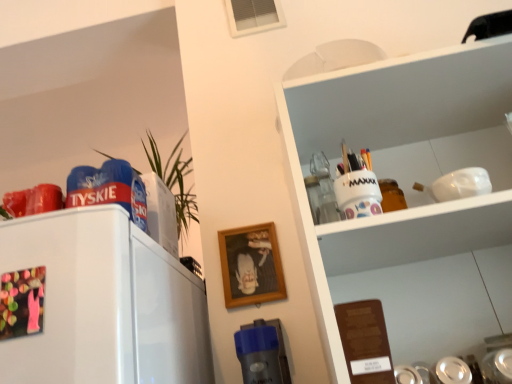
Image resolution: width=512 pixels, height=384 pixels. Describe the element at coordinates (105, 303) in the screenshot. I see `white matte refrigerator at left` at that location.

Where is `white matte refrigerator at left`? Image resolution: width=512 pixels, height=384 pixels. white matte refrigerator at left is located at coordinates (105, 303).

Measure the distance between point (168, 300) and camera.

31.30 inches.

In order to face white matte refrigerator at left, should I rotate leftwards or rightwards?

You should look left and rotate roughly 17.501 degrees.

Find the location of a particular element. Image resolution: width=512 pixels, height=384 pixels. white matte refrigerator at left is located at coordinates (105, 303).